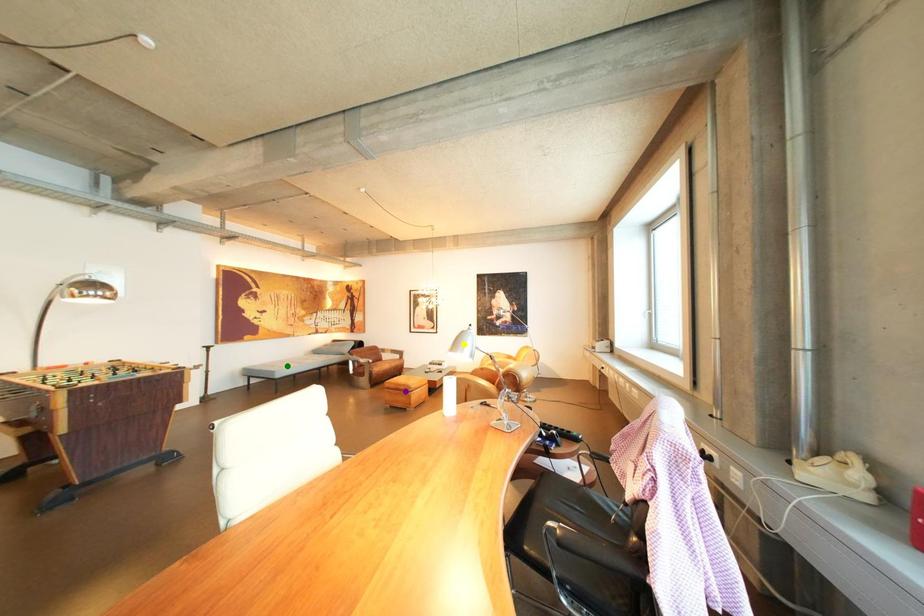
Order these from nearest to farthest:
yellow point | green point | purple point

yellow point
purple point
green point